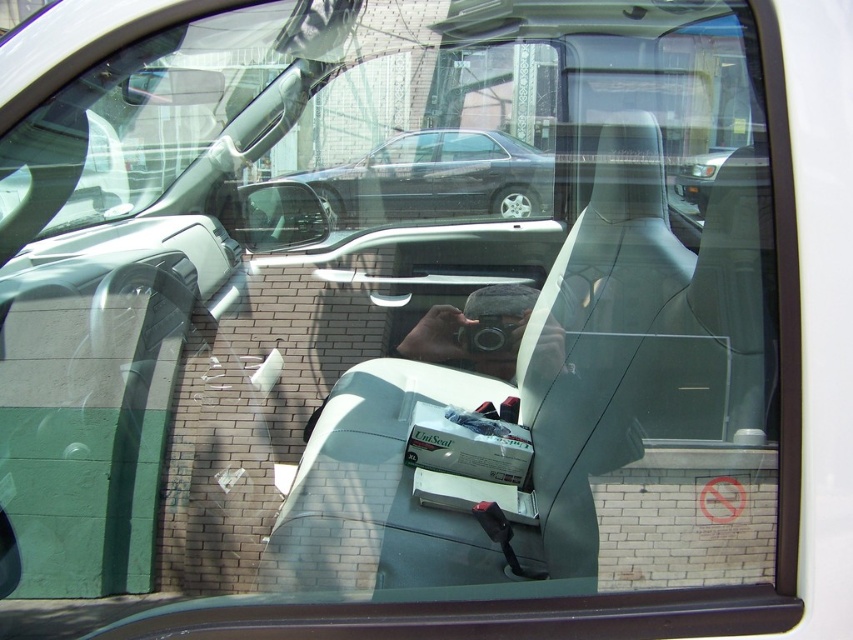
Is shiny black sedan at center wider than matte plastic side mirror at upper left?

Indeed, shiny black sedan at center has a greater width compared to matte plastic side mirror at upper left.

Between point (372, 205) and point (316, 225), which one is positioned in front?

Point (316, 225) is more forward.

You are a GUI agent. You are given a task and a screenshot of the screen. Output one action in this format:
    pyautogui.click(x=<x>, y=<y>)
    Task: Click on the shiny black sedan at center
    This screenshot has width=853, height=640.
    Given the screenshot: What is the action you would take?
    pyautogui.click(x=436, y=179)